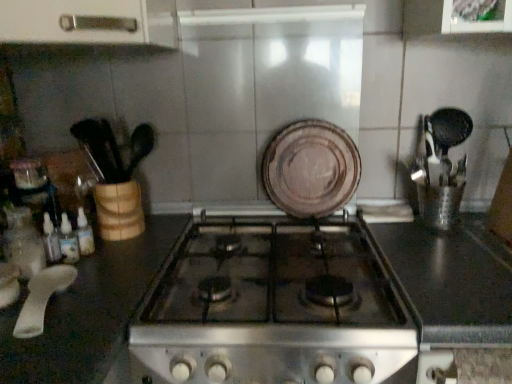
I want to click on black glass stove at center, so click(268, 306).

Where is `white plastic spoon at lower left`? The image size is (512, 384). white plastic spoon at lower left is located at coordinates (42, 298).

Find the location of a particular element. black glass stove at center is located at coordinates (268, 306).

Can you confirm if black glass stove at center is thinner than brown matte plate at center?

No.

From the image's perspective, is black glass stove at center located above brown matte plate at center?

Actually, black glass stove at center appears below brown matte plate at center in the image.

Is black glass stove at center at the left side of brown matte plate at center?

Correct, you'll find black glass stove at center to the left of brown matte plate at center.

Considering the sizes of objects white plastic spoon at lower left and black glass stove at center in the image provided, who is taller, white plastic spoon at lower left or black glass stove at center?

With more height is black glass stove at center.

In the scene shown: Does white plastic spoon at lower left contain black glass stove at center?

No, black glass stove at center is not surrounded by white plastic spoon at lower left.

From the image's perspective, which one is positioned lower, white plastic spoon at lower left or black glass stove at center?

black glass stove at center, from the image's perspective.

Does white plastic spoon at lower left touch black glass stove at center?

No, white plastic spoon at lower left is not next to black glass stove at center.

Is white plastic spoon at lower left oriented away from brown matte plate at center?

That's not correct — white plastic spoon at lower left is not looking away from brown matte plate at center.

Which of these two, white plastic spoon at lower left or brown matte plate at center, is smaller?

Smaller between the two is white plastic spoon at lower left.

Between white plastic spoon at lower left and brown matte plate at center, which one has more height?

Standing taller between the two is brown matte plate at center.

Considering the relative positions of white plastic spoon at lower left and brown matte plate at center in the image provided, is white plastic spoon at lower left in front of brown matte plate at center?

Yes, white plastic spoon at lower left is closer to the viewer.

Which object is wider, brown matte plate at center or white plastic spoon at lower left?

Wider between the two is white plastic spoon at lower left.

Is brown matte plate at center to the left or to the right of white plastic spoon at lower left in the image?

brown matte plate at center is to the right of white plastic spoon at lower left.

From a real-world perspective, who is located lower, brown matte plate at center or white plastic spoon at lower left?

From a 3D spatial view, white plastic spoon at lower left is below.

Could you tell me if brown matte plate at center is turned towards black glass stove at center?

Yes, brown matte plate at center faces towards black glass stove at center.

Is the surface of brown matte plate at center in direct contact with black glass stove at center?

brown matte plate at center and black glass stove at center are not in contact.

Is brown matte plate at center wider or thinner than black glass stove at center?

Considering their sizes, brown matte plate at center looks slimmer than black glass stove at center.

Which point is more forward, (260, 375) or (55, 268)?

The point (260, 375) is closer.

Is black glass stove at center in front of or behind white plastic spoon at lower left in the image?

Visually, black glass stove at center is located in front of white plastic spoon at lower left.

In the scene shown: Is the surface of black glass stove at center in direct contact with white plastic spoon at lower left?

No, black glass stove at center is not in contact with white plastic spoon at lower left.

Is white plastic spoon at lower left at the back of black glass stove at center?

That's not correct — black glass stove at center is not looking away from white plastic spoon at lower left.

Where is `countertop on the left of brown matte plate at center`? This screenshot has height=384, width=512. countertop on the left of brown matte plate at center is located at coordinates (268, 306).

In the image, there is a white plastic spoon at lower left. Where is `countertop below it (from a real-world perspective)`? countertop below it (from a real-world perspective) is located at coordinates (268, 306).

Estimate the real-world distances between objects in this image. Which object is closer to white plastic spoon at lower left, black glass stove at center or brown matte plate at center?

black glass stove at center lies closer to white plastic spoon at lower left than the other object.

Based on their spatial positions, is black glass stove at center or white plastic spoon at lower left closer to brown matte plate at center?

The object closer to brown matte plate at center is black glass stove at center.

Based on the photo, from the image, which object appears to be farther from brown matte plate at center, white plastic spoon at lower left or black glass stove at center?

white plastic spoon at lower left is positioned further to the anchor brown matte plate at center.

Based on their spatial positions, is brown matte plate at center or black glass stove at center further from white plastic spoon at lower left?

brown matte plate at center lies further to white plastic spoon at lower left than the other object.

When comparing their distances from black glass stove at center, does brown matte plate at center or white plastic spoon at lower left seem closer?

brown matte plate at center.

From the image, which object appears to be farther from black glass stove at center, white plastic spoon at lower left or brown matte plate at center?

Based on the image, white plastic spoon at lower left appears to be further to black glass stove at center.

Where is `countertop situated between white plastic spoon at lower left and brown matte plate at center from left to right`? This screenshot has width=512, height=384. countertop situated between white plastic spoon at lower left and brown matte plate at center from left to right is located at coordinates (268, 306).